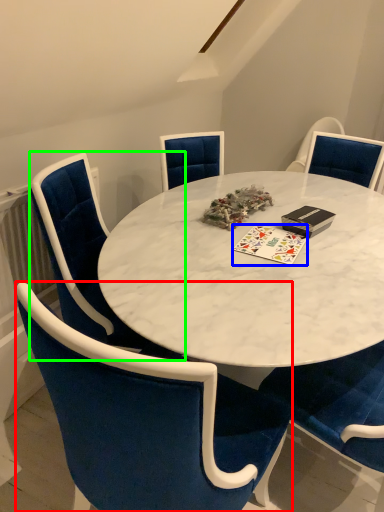
Question: Considering the real-world distances, which object is farthest from chair (highlighted by a red box)? card game (highlighted by a blue box) or chair (highlighted by a green box)?

Choices:
 (A) card game
 (B) chair

Answer: (A)